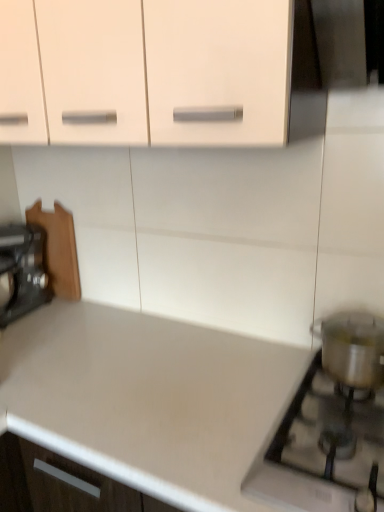
Question: Considering the relative positions of wooden cutting board at left and metallic silver pot at right in the image provided, is wooden cutting board at left behind metallic silver pot at right?

Choices:
 (A) no
 (B) yes

Answer: (B)

Question: Is there a large distance between wooden cutting board at left and metallic silver pot at right?

Choices:
 (A) yes
 (B) no

Answer: (A)

Question: Is wooden cutting board at left looking in the opposite direction of metallic silver pot at right?

Choices:
 (A) no
 (B) yes

Answer: (A)

Question: Does wooden cutting board at left turn towards metallic silver pot at right?

Choices:
 (A) no
 (B) yes

Answer: (A)

Question: Can you confirm if wooden cutting board at left is positioned to the right of metallic silver pot at right?

Choices:
 (A) yes
 (B) no

Answer: (B)

Question: From the image's perspective, is wooden cutting board at left on top of metallic silver pot at right?

Choices:
 (A) no
 (B) yes

Answer: (B)

Question: Is metallic silver pot at right taller than wooden cutting board at left?

Choices:
 (A) yes
 (B) no

Answer: (B)

Question: Can you confirm if metallic silver pot at right is positioned to the left of wooden cutting board at left?

Choices:
 (A) yes
 (B) no

Answer: (B)

Question: From the image's perspective, is metallic silver pot at right located above wooden cutting board at left?

Choices:
 (A) no
 (B) yes

Answer: (A)

Question: Considering the relative sizes of metallic silver pot at right and wooden cutting board at left in the image provided, is metallic silver pot at right wider than wooden cutting board at left?

Choices:
 (A) no
 (B) yes

Answer: (A)

Question: Is metallic silver pot at right positioned behind wooden cutting board at left?

Choices:
 (A) yes
 (B) no

Answer: (B)

Question: Is metallic silver pot at right positioned in front of wooden cutting board at left?

Choices:
 (A) yes
 (B) no

Answer: (A)

Question: Is satin silver pot at lower right bigger than metallic silver pot at right?

Choices:
 (A) yes
 (B) no

Answer: (A)